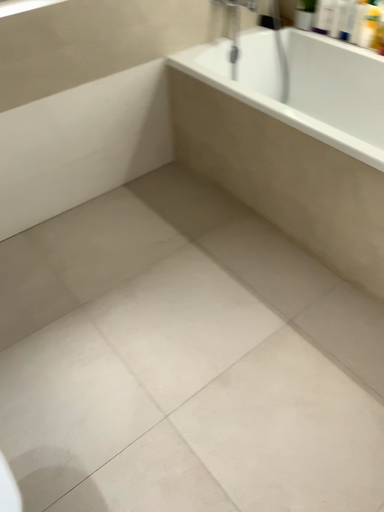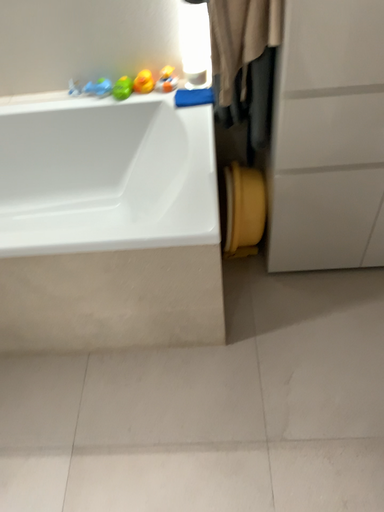
Question: How did the camera likely rotate when shooting the video?

Choices:
 (A) rotated right
 (B) rotated left

Answer: (A)